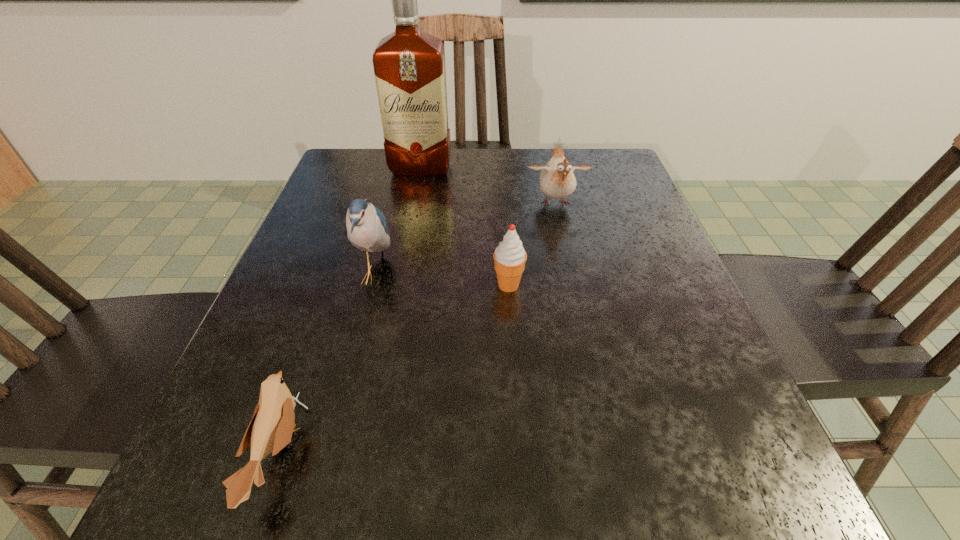
Select which object is the second closest to the second object from right to left. Please provide its 2D coordinates. Your answer should be formatted as a tuple, i.e. [(x, y)], where the tuple contains the x and y coordinates of a point satisfying the conditions above.

[(367, 230)]

You are a GUI agent. You are given a task and a screenshot of the screen. Output one action in this format:
    pyautogui.click(x=<x>, y=<y>)
    Task: Click on the object that is the closest to the second object from right to left
    The width and height of the screenshot is (960, 540).
    Given the screenshot: What is the action you would take?
    pyautogui.click(x=557, y=180)

What are the coordinates of `the second closest bird to the fourth shortest object` in the screenshot? It's located at (557, 180).

Locate an element on the screen. The image size is (960, 540). bird identified as the closest to the fourth shortest object is located at coordinates (270, 430).

Image resolution: width=960 pixels, height=540 pixels. Find the location of `free space in the image that satisfies the following two spatial constraints: 1. on the front side of the fourth object from left to right; 2. at the beak of the nearest bird`. free space in the image that satisfies the following two spatial constraints: 1. on the front side of the fourth object from left to right; 2. at the beak of the nearest bird is located at coordinates (519, 455).

At what (x,y) coordinates should I click in order to perform the action: click on vacant position in the image that satisfies the following two spatial constraints: 1. at the tip of the second nearest bird's beak; 2. on the back side of the icecream. Please return your answer as a coordinate pair (x, y). Image resolution: width=960 pixels, height=540 pixels. Looking at the image, I should click on (372, 285).

You are a GUI agent. You are given a task and a screenshot of the screen. Output one action in this format:
    pyautogui.click(x=<x>, y=<y>)
    Task: Click on the free location that satisfies the following two spatial constraints: 1. at the beak of the second tallest bird; 2. at the tip of the second farthest bird's beak
    The width and height of the screenshot is (960, 540).
    Given the screenshot: What is the action you would take?
    pyautogui.click(x=571, y=275)

Find the location of `vacant area that satisfies the following two spatial constraints: 1. on the front label of the tallest object; 2. at the beak of the shortest bird`. vacant area that satisfies the following two spatial constraints: 1. on the front label of the tallest object; 2. at the beak of the shortest bird is located at coordinates (365, 455).

Image resolution: width=960 pixels, height=540 pixels. What are the coordinates of `free location that satisfies the following two spatial constraints: 1. at the tip of the fourth object from left to right's beak; 2. on the right side of the tallest bird` in the screenshot? It's located at (372, 285).